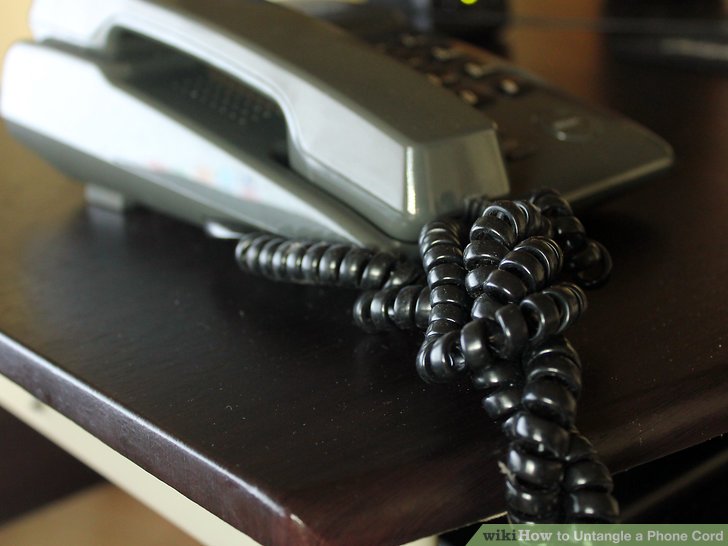
This screenshot has width=728, height=546. Identify the location of speaker. (217, 100).